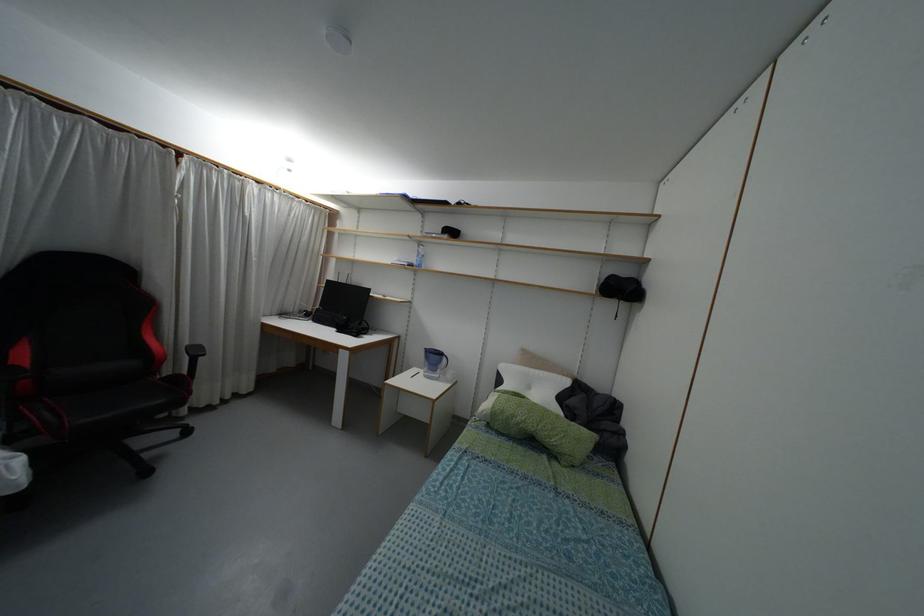
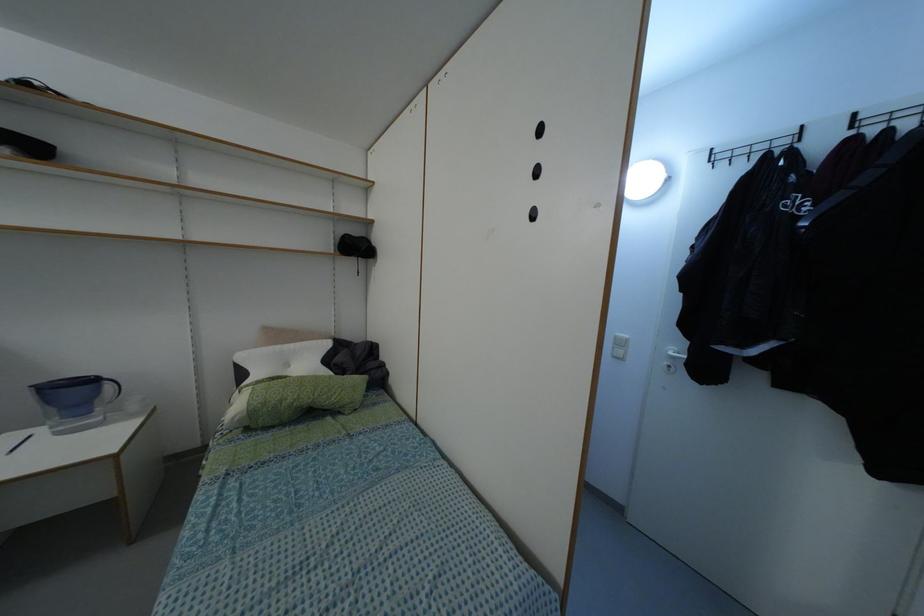
Question: The camera is either moving clockwise (left) or counter-clockwise (right) around the object. The first image is from the beginning of the video and the second image is from the end. Is the camera moving left or right when shooting the video?

Choices:
 (A) Left
 (B) Right

Answer: (A)